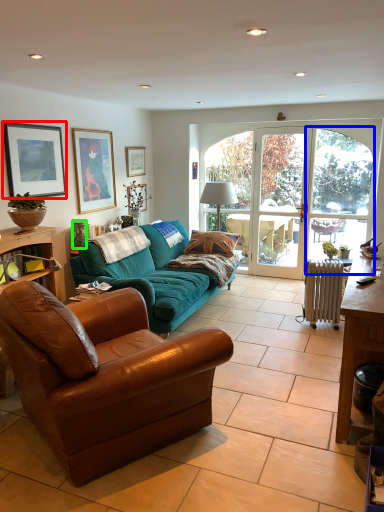
Question: Considering the real-world distances, which object is farthest from picture frame (highlighted by a red box)? window screen (highlighted by a blue box) or vase (highlighted by a green box)?

Choices:
 (A) window screen
 (B) vase

Answer: (A)